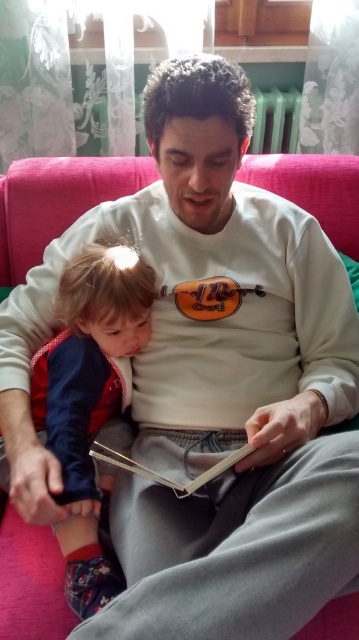
Question: Does velvet red jacket at lower left have a lesser width compared to hardcover book at center?

Choices:
 (A) no
 (B) yes

Answer: (B)

Question: Does velvet red jacket at lower left have a smaller size compared to hardcover book at center?

Choices:
 (A) yes
 (B) no

Answer: (B)

Question: Can you confirm if velvet red jacket at lower left is positioned below hardcover book at center?

Choices:
 (A) yes
 (B) no

Answer: (B)

Question: Which object appears closest to the camera in this image?

Choices:
 (A) velvet red jacket at lower left
 (B) hardcover book at center

Answer: (A)

Question: Among these objects, which one is nearest to the camera?

Choices:
 (A) hardcover book at center
 (B) velvet red jacket at lower left

Answer: (B)